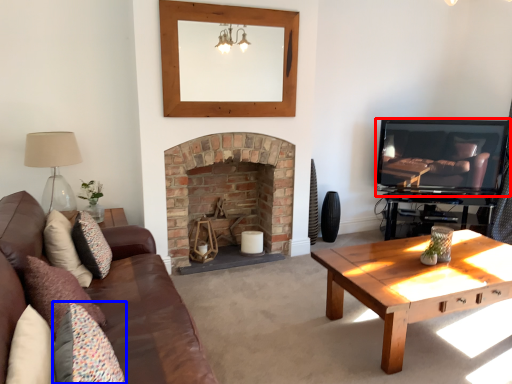
Question: Which object is further to the camera taking this photo, television (highlighted by a red box) or pillow (highlighted by a blue box)?

Choices:
 (A) television
 (B) pillow

Answer: (A)